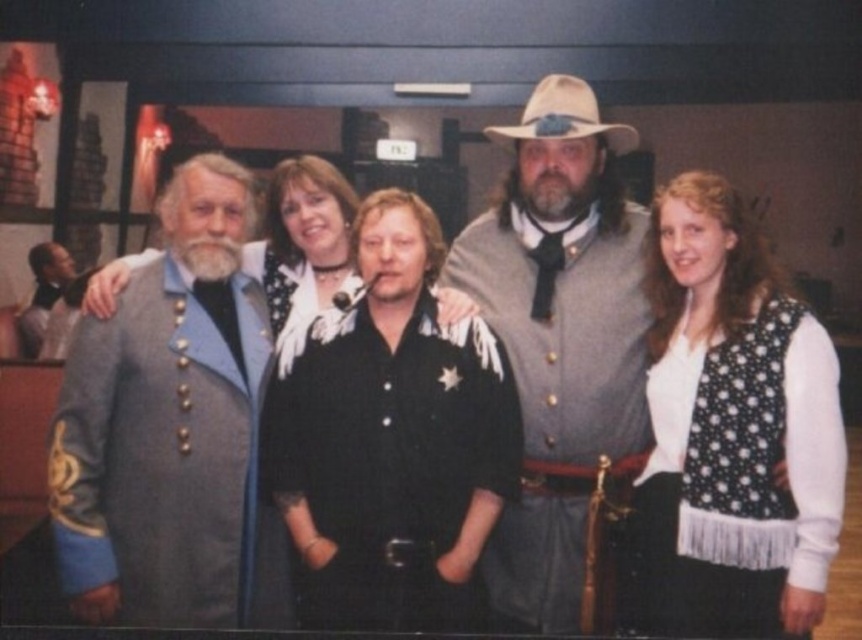
Question: Among these points, which one is farthest from the camera?

Choices:
 (A) (220, 467)
 (B) (684, 524)
 (C) (588, 120)

Answer: (C)

Question: Can you confirm if gray wool coat at left is positioned to the left of black leather shirt at center?

Choices:
 (A) yes
 (B) no

Answer: (A)

Question: Does gray wool coat at left appear on the left side of beige felt cowboy hat at center?

Choices:
 (A) yes
 (B) no

Answer: (A)

Question: Which point is closer to the camera?

Choices:
 (A) white dotted vest at center
 (B) beige felt cowboy hat at center
 (C) gray woolen coat at center

Answer: (A)

Question: Which of these objects is positioned farthest from the black leather shirt at center?

Choices:
 (A) gray woolen coat at center
 (B) gray wool coat at left
 (C) white dotted vest at center

Answer: (C)

Question: Does white dotted vest at center have a lesser width compared to black leather shirt at center?

Choices:
 (A) yes
 (B) no

Answer: (A)